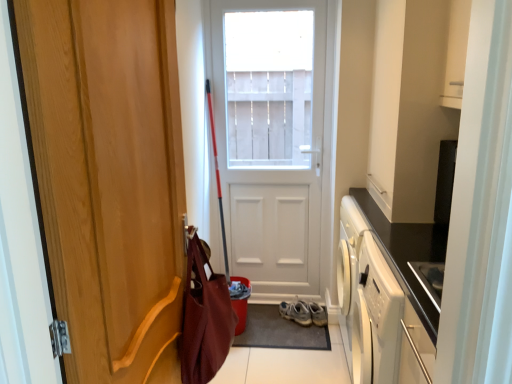
Find the location of a particular element. The width and height of the screenshot is (512, 384). white matte cabinet at upper right is located at coordinates (413, 101).

The image size is (512, 384). What are the coordinates of `gray suede sneakers at lower center` in the screenshot? It's located at (304, 313).

This screenshot has width=512, height=384. Describe the element at coordinates (275, 137) in the screenshot. I see `white matte door at center, acting as the second door starting from the front` at that location.

Locate an element on the screen. wooden door at left, the 2th door from the right is located at coordinates (109, 179).

Between white matte door at center, which is counted as the first door, starting from the back, and wooden door at left, which is the 2th door in back-to-front order, which one has more height?

Standing taller between the two is white matte door at center, which is counted as the first door, starting from the back.

Which is closer to the camera, (215,123) or (84,71)?

Point (215,123).

Is white matte door at center, placed as the first door when sorted from right to left, facing away from wooden door at left, the 2th door from the right?

That's not correct — white matte door at center, placed as the first door when sorted from right to left, is not looking away from wooden door at left, the 2th door from the right.

Looking at this image, considering the sizes of objects white matte door at center, acting as the second door starting from the front, and wooden door at left, the 2th door from the right, in the image provided, who is thinner, white matte door at center, acting as the second door starting from the front, or wooden door at left, the 2th door from the right,?

Thinner between the two is wooden door at left, the 2th door from the right.

From the picture: Which of these two, white matte cabinet at upper right or dark gray rubber doormat at center, stands taller?

With more height is white matte cabinet at upper right.

Can you confirm if white matte cabinet at upper right is wider than dark gray rubber doormat at center?

In fact, white matte cabinet at upper right might be narrower than dark gray rubber doormat at center.

Which is farther, (442, 15) or (259, 320)?

Point (259, 320)

Looking at their sizes, would you say white matte cabinet at upper right is wider or thinner than wooden door at left, the 2th door from the right?

Clearly, white matte cabinet at upper right has more width compared to wooden door at left, the 2th door from the right.

Does white matte cabinet at upper right touch wooden door at left, which is the 2th door in back-to-front order?

No, white matte cabinet at upper right is not in contact with wooden door at left, which is the 2th door in back-to-front order.

Visually, is white matte cabinet at upper right positioned to the left or to the right of wooden door at left, the 2th door from the right?

white matte cabinet at upper right is positioned on wooden door at left, the 2th door from the right,'s right side.

Is white matte door at center, which is the second door from left to right, in front of or behind gray suede sneakers at lower center in the image?

white matte door at center, which is the second door from left to right, is positioned closer to the viewer than gray suede sneakers at lower center.

In the scene shown: Does white matte door at center, which is the second door from left to right, have a smaller size compared to gray suede sneakers at lower center?

No, white matte door at center, which is the second door from left to right, is not smaller than gray suede sneakers at lower center.

Considering the relative positions of white matte door at center, which is the second door from left to right, and gray suede sneakers at lower center in the image provided, is white matte door at center, which is the second door from left to right, to the left of gray suede sneakers at lower center from the viewer's perspective?

Correct, you'll find white matte door at center, which is the second door from left to right, to the left of gray suede sneakers at lower center.

Considering the relative sizes of white matte door at center, placed as the first door when sorted from right to left, and gray suede sneakers at lower center in the image provided, is white matte door at center, placed as the first door when sorted from right to left, thinner than gray suede sneakers at lower center?

Indeed, white matte door at center, placed as the first door when sorted from right to left, has a lesser width compared to gray suede sneakers at lower center.

Does point (286, 324) appear closer or farther from the camera than point (283, 309)?

Point (286, 324).

From a real-world perspective, does dark gray rubber doormat at center sit lower than gray suede sneakers at lower center?

Yes, from a real-world perspective, dark gray rubber doormat at center is under gray suede sneakers at lower center.

Is dark gray rubber doormat at center beside gray suede sneakers at lower center?

dark gray rubber doormat at center and gray suede sneakers at lower center are clearly separated.

From the image's perspective, which is below, dark gray rubber doormat at center or gray suede sneakers at lower center?

dark gray rubber doormat at center.

Which object is wider, white matte cabinet at upper right or gray suede sneakers at lower center?

With larger width is white matte cabinet at upper right.

Does white matte cabinet at upper right touch gray suede sneakers at lower center?

white matte cabinet at upper right is not next to gray suede sneakers at lower center, and they're not touching.

Considering the points (404, 218) and (307, 319), which point is behind, point (404, 218) or point (307, 319)?

The point (307, 319) is farther from the camera.

Is point (222, 337) closer to camera compared to point (282, 340)?

Yes.

Considering the relative positions of maroon fabric messenger bag at left and dark gray rubber doormat at center in the image provided, is maroon fabric messenger bag at left in front of dark gray rubber doormat at center?

Yes, it is in front of dark gray rubber doormat at center.

Could you tell me if maroon fabric messenger bag at left is facing dark gray rubber doormat at center?

No, maroon fabric messenger bag at left is not turned towards dark gray rubber doormat at center.

The image size is (512, 384). In order to click on door directly beneath the wooden door at left, which is the 1th door from left to right (from a real-world perspective) in this screenshot , I will do `click(275, 137)`.

Locate an element on the screen. The height and width of the screenshot is (384, 512). cabinetry that is above the dark gray rubber doormat at center (from the image's perspective) is located at coordinates pos(413,101).

Looking at the image, which one is located closer to white matte door at center, which is counted as the first door, starting from the back, maroon fabric messenger bag at left or white matte cabinet at upper right?

white matte cabinet at upper right.

Estimate the real-world distances between objects in this image. Which object is further from wooden door at left, the 2th door from the right, white matte cabinet at upper right or gray suede sneakers at lower center?

gray suede sneakers at lower center is further to wooden door at left, the 2th door from the right.

Based on their spatial positions, is white matte cabinet at upper right or maroon fabric messenger bag at left closer to dark gray rubber doormat at center?

The object closer to dark gray rubber doormat at center is maroon fabric messenger bag at left.

Looking at the image, which one is located further to white matte cabinet at upper right, dark gray rubber doormat at center or white matte door at center, placed as the first door when sorted from right to left?

dark gray rubber doormat at center.

Based on their spatial positions, is wooden door at left, which is the 1th door from left to right, or white matte door at center, acting as the second door starting from the front, further from gray suede sneakers at lower center?

The object further to gray suede sneakers at lower center is wooden door at left, which is the 1th door from left to right.

When comparing their distances from white matte door at center, which is counted as the first door, starting from the back, does maroon fabric messenger bag at left or gray suede sneakers at lower center seem further?

The object further to white matte door at center, which is counted as the first door, starting from the back, is maroon fabric messenger bag at left.

Considering their positions, is wooden door at left, the first door viewed from the front, positioned further to maroon fabric messenger bag at left than gray suede sneakers at lower center?

gray suede sneakers at lower center.

From the image, which object appears to be farther from white matte cabinet at upper right, white matte door at center, which is counted as the first door, starting from the back, or maroon fabric messenger bag at left?

maroon fabric messenger bag at left is further to white matte cabinet at upper right.

Identify the location of door positioned between maroon fabric messenger bag at left and gray suede sneakers at lower center from near to far. (275, 137).

Find the location of a particular element. cabinetry between maroon fabric messenger bag at left and white matte door at center, which is the second door from left to right, along the z-axis is located at coordinates (413, 101).

At what (x,y) coordinates should I click in order to perform the action: click on door between maroon fabric messenger bag at left and dark gray rubber doormat at center along the z-axis. Please return your answer as a coordinate pair (x, y). The image size is (512, 384). Looking at the image, I should click on (275, 137).

Locate an element on the screen. The image size is (512, 384). doormat between wooden door at left, the 2th door from the right, and gray suede sneakers at lower center in the front-back direction is located at coordinates (280, 331).